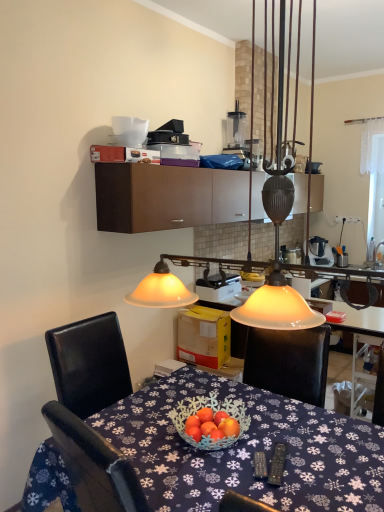
Question: Does white plastic blender at upper center, which appears as the 1th appliance when viewed from the back, have a greater height compared to blue fabric tablecloth at center?

Choices:
 (A) yes
 (B) no

Answer: (B)

Question: Does white plastic blender at upper center, positioned as the 2th appliance in bottom-to-top order, touch blue fabric tablecloth at center?

Choices:
 (A) yes
 (B) no

Answer: (B)

Question: Is white plastic blender at upper center, which appears as the 1th appliance when viewed from the back, shorter than blue fabric tablecloth at center?

Choices:
 (A) no
 (B) yes

Answer: (B)

Question: Can you confirm if white plastic blender at upper center, the 1th appliance viewed from the top, is positioned to the right of blue fabric tablecloth at center?

Choices:
 (A) no
 (B) yes

Answer: (B)

Question: From the image's perspective, is white plastic blender at upper center, the 1th appliance viewed from the top, on top of blue fabric tablecloth at center?

Choices:
 (A) yes
 (B) no

Answer: (A)

Question: In the image, is blue fabric tablecloth at center on the left side or the right side of white plastic toaster at center, placed as the 2th appliance when sorted from back to front?

Choices:
 (A) right
 (B) left

Answer: (B)

Question: From the image's perspective, is blue fabric tablecloth at center located above or below white plastic toaster at center, the first appliance from the front?

Choices:
 (A) above
 (B) below

Answer: (B)

Question: Is blue fabric tablecloth at center spatially inside white plastic toaster at center, acting as the second appliance starting from the top, or outside of it?

Choices:
 (A) outside
 (B) inside

Answer: (A)

Question: Considering the positions of blue fabric tablecloth at center and white plastic toaster at center, which appears as the first appliance when ordered from the bottom, in the image, is blue fabric tablecloth at center bigger or smaller than white plastic toaster at center, which appears as the first appliance when ordered from the bottom,?

Choices:
 (A) big
 (B) small

Answer: (A)

Question: Relative to brown matte cabinet at upper center, is blue fabric tablecloth at center in front or behind?

Choices:
 (A) behind
 (B) front

Answer: (B)

Question: Looking at the image, does blue fabric tablecloth at center seem bigger or smaller compared to brown matte cabinet at upper center?

Choices:
 (A) small
 (B) big

Answer: (B)

Question: From the image's perspective, relative to brown matte cabinet at upper center, is blue fabric tablecloth at center above or below?

Choices:
 (A) below
 (B) above

Answer: (A)

Question: From a real-world perspective, is blue fabric tablecloth at center positioned above or below brown matte cabinet at upper center?

Choices:
 (A) above
 (B) below

Answer: (B)

Question: In terms of height, does white plastic toaster at center, which appears as the first appliance when ordered from the bottom, look taller or shorter compared to blue fabric tablecloth at center?

Choices:
 (A) short
 (B) tall

Answer: (A)

Question: In terms of size, does white plastic toaster at center, acting as the second appliance starting from the top, appear bigger or smaller than blue fabric tablecloth at center?

Choices:
 (A) small
 (B) big

Answer: (A)